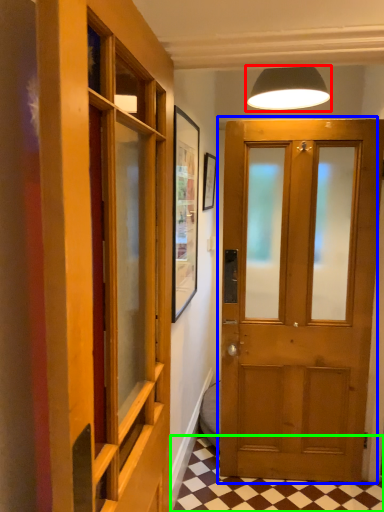
Question: Based on their relative distances, which object is farther from lamp (highlighted by a red box)? Choose from door (highlighted by a blue box) and tile (highlighted by a green box).

Choices:
 (A) door
 (B) tile

Answer: (B)